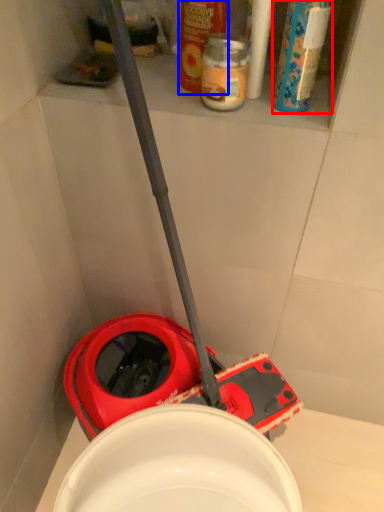
Question: Which point is closer to the camera, cleaning product (highlighted by a red box) or cleaning product (highlighted by a blue box)?

Choices:
 (A) cleaning product
 (B) cleaning product

Answer: (A)